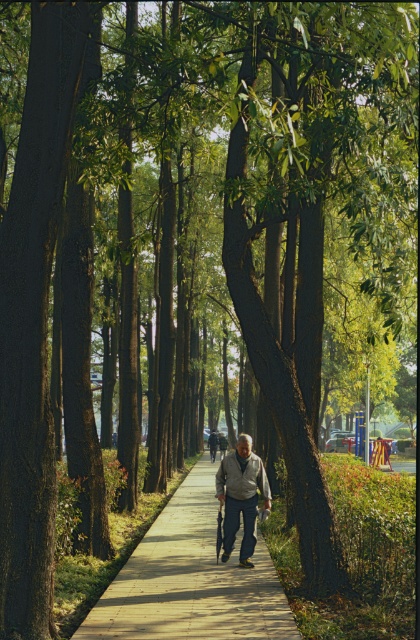
Who is positioned more to the left, wooden boardwalk at center or dark gray fabric couple at center?

wooden boardwalk at center is more to the left.

Is wooden boardwalk at center taller than dark gray fabric couple at center?

Incorrect, wooden boardwalk at center's height is not larger of dark gray fabric couple at center's.

Image resolution: width=420 pixels, height=640 pixels. Find the location of `wooden boardwalk at center`. wooden boardwalk at center is located at coordinates (191, 579).

At what (x,y) coordinates should I click in order to perform the action: click on wooden boardwalk at center. Please return your answer as a coordinate pair (x, y). This screenshot has width=420, height=640. Looking at the image, I should click on (191, 579).

Which of these two, wooden boardwalk at center or gray fabric jacket at center, stands taller?

With more height is gray fabric jacket at center.

Looking at this image, who is positioned more to the left, wooden boardwalk at center or gray fabric jacket at center?

Positioned to the left is wooden boardwalk at center.

At what (x,y) coordinates should I click in order to perform the action: click on wooden boardwalk at center. Please return your answer as a coordinate pair (x, y). Looking at the image, I should click on (191, 579).

Find the location of a particular element. The width and height of the screenshot is (420, 640). wooden boardwalk at center is located at coordinates (191, 579).

Between point (236, 444) and point (223, 444), which one is positioned behind?

The point (223, 444) is more distant.

Is gray fabric jacket at center wider than dark gray fabric couple at center?

In fact, gray fabric jacket at center might be narrower than dark gray fabric couple at center.

Describe the element at coordinates (241, 497) in the screenshot. I see `gray fabric jacket at center` at that location.

Where is `gray fabric jacket at center`? gray fabric jacket at center is located at coordinates (241, 497).